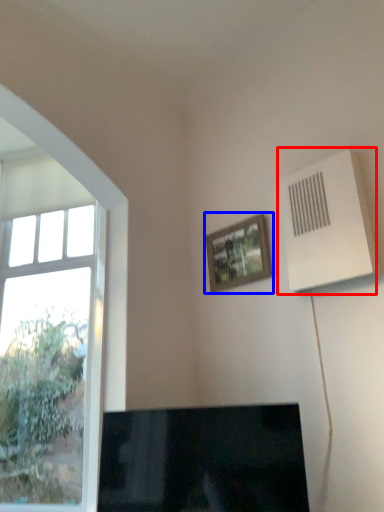
Question: Which object appears closest to the camera in this image, air conditioning (highlighted by a red box) or picture frame (highlighted by a blue box)?

Choices:
 (A) air conditioning
 (B) picture frame

Answer: (A)